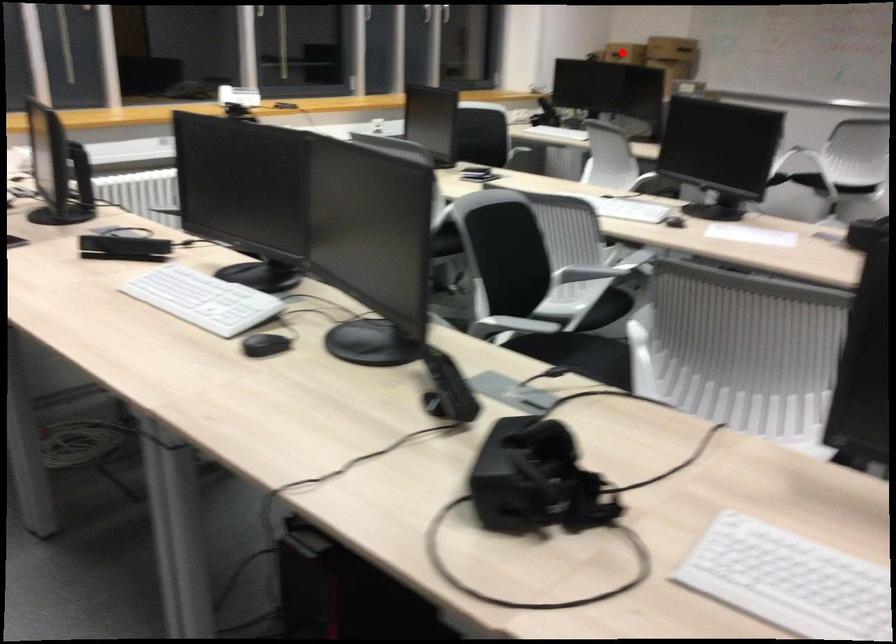
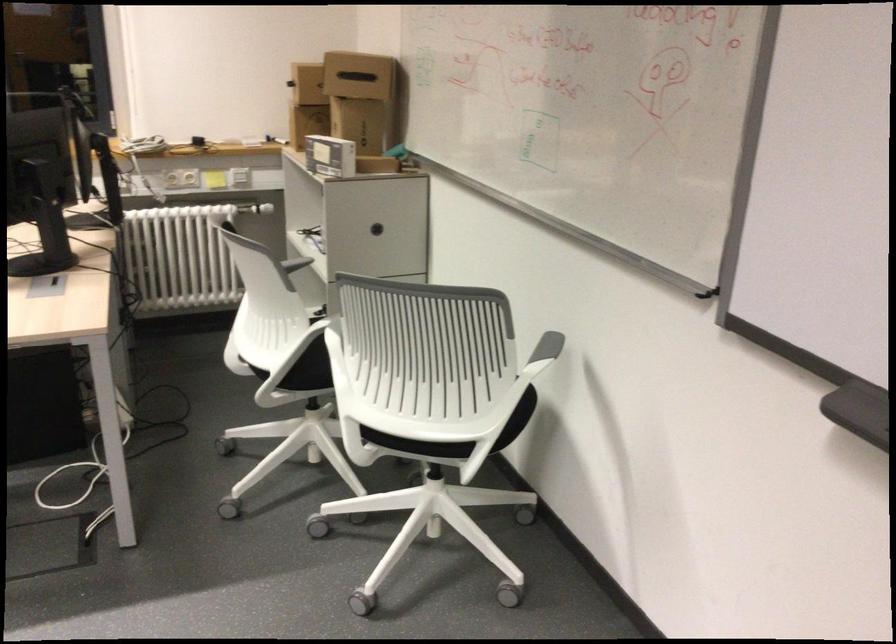
Question: I am providing you with two images of the same scene from different viewpoints. A red point is marked on the first image. Can you still see the location of the red point in image 2?

Choices:
 (A) Yes
 (B) No

Answer: (B)